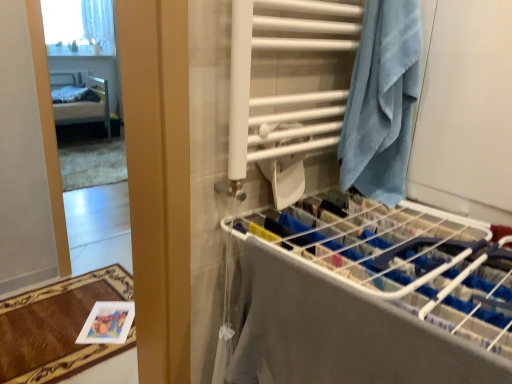
Question: Is brown plush bath mat at lower left outside of blue towel at right?

Choices:
 (A) no
 (B) yes

Answer: (B)

Question: Does brown plush bath mat at lower left have a smaller size compared to blue towel at right?

Choices:
 (A) no
 (B) yes

Answer: (B)

Question: From a real-world perspective, does brown plush bath mat at lower left stand above blue towel at right?

Choices:
 (A) yes
 (B) no

Answer: (B)

Question: Can you confirm if brown plush bath mat at lower left is shorter than blue towel at right?

Choices:
 (A) yes
 (B) no

Answer: (A)

Question: Considering the relative positions of brown plush bath mat at lower left and blue towel at right in the image provided, is brown plush bath mat at lower left to the left of blue towel at right from the viewer's perspective?

Choices:
 (A) yes
 (B) no

Answer: (A)

Question: Is brown plush bath mat at lower left positioned far away from blue towel at right?

Choices:
 (A) no
 (B) yes

Answer: (B)

Question: From the image's perspective, is clear glass mirror at left located beneath white sheer curtain at upper left?

Choices:
 (A) no
 (B) yes

Answer: (B)

Question: Is clear glass mirror at left positioned with its back to white sheer curtain at upper left?

Choices:
 (A) yes
 (B) no

Answer: (B)

Question: Would you consider clear glass mirror at left to be distant from white sheer curtain at upper left?

Choices:
 (A) no
 (B) yes

Answer: (A)

Question: Is clear glass mirror at left positioned beyond the bounds of white sheer curtain at upper left?

Choices:
 (A) no
 (B) yes

Answer: (B)

Question: Is white sheer curtain at upper left a part of clear glass mirror at left?

Choices:
 (A) no
 (B) yes

Answer: (A)

Question: Does clear glass mirror at left have a larger size compared to white sheer curtain at upper left?

Choices:
 (A) no
 (B) yes

Answer: (B)

Question: Is metallic silver bed at left taller than white sheer curtain at upper left?

Choices:
 (A) no
 (B) yes

Answer: (B)